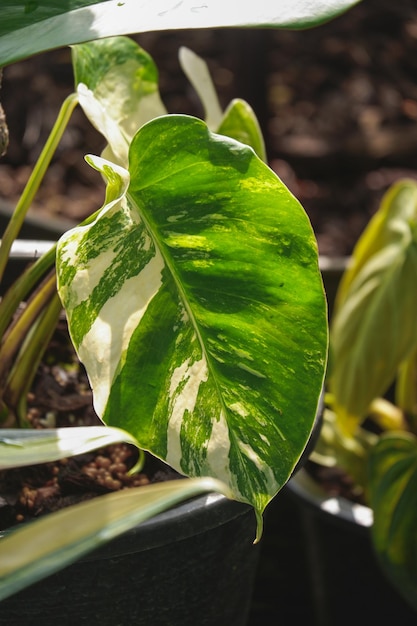
Find the location of a particular element. Image resolution: width=417 pixels, height=626 pixels. sand and stones in vase is located at coordinates (83, 476), (99, 474).